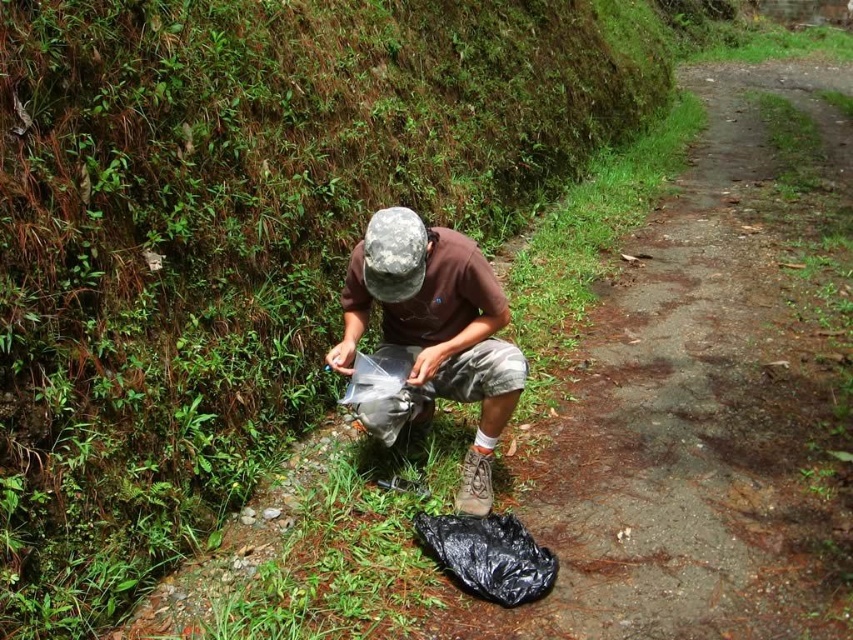
You are a hiker who needs to choose between two plastic bags to carry your gear. The black plastic bag at lower center and the transparent plastic bag at center are available. Which bag is taller?

The transparent plastic bag at center is taller than the black plastic bag at lower center.

Looking at this image, you are a photographer trying to capture a closeup of the matte gray cap at center and the black plastic bag at lower center. Which object should you focus on first if you want to ensure both are in focus without adjusting the camera focus?

The matte gray cap at center has a greater height compared to the black plastic bag at lower center. Since it is taller, you should focus on the matte gray cap at center first to ensure both are in focus.